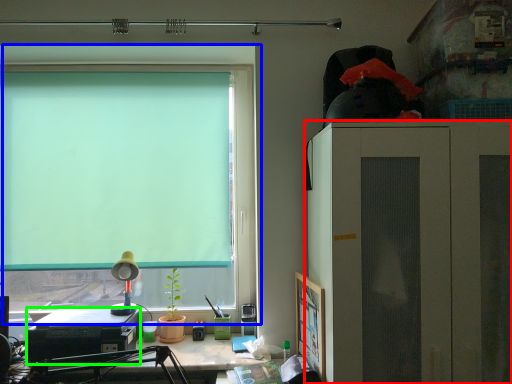
Question: Which object is positioned closest to cabinetry (highlighted by a red box)? Select from window (highlighted by a blue box) and laptop (highlighted by a green box).

Choices:
 (A) window
 (B) laptop

Answer: (A)